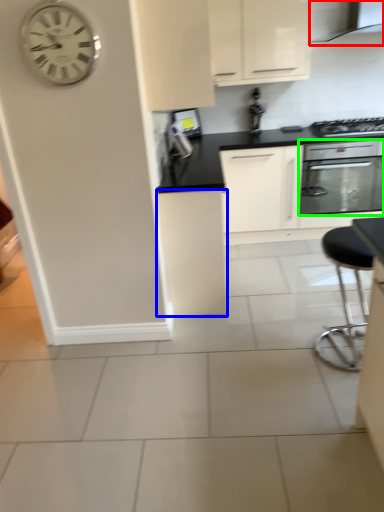
Question: Estimate the real-world distances between objects in this image. Which object is farther from exhaust hood (highlighted by a red box), cabinetry (highlighted by a blue box) or home appliance (highlighted by a green box)?

Choices:
 (A) cabinetry
 (B) home appliance

Answer: (A)